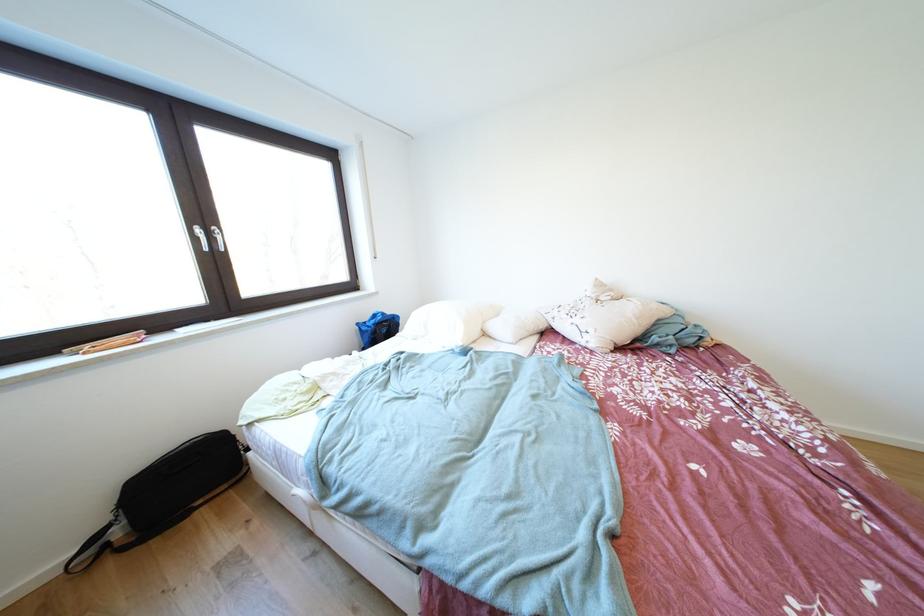
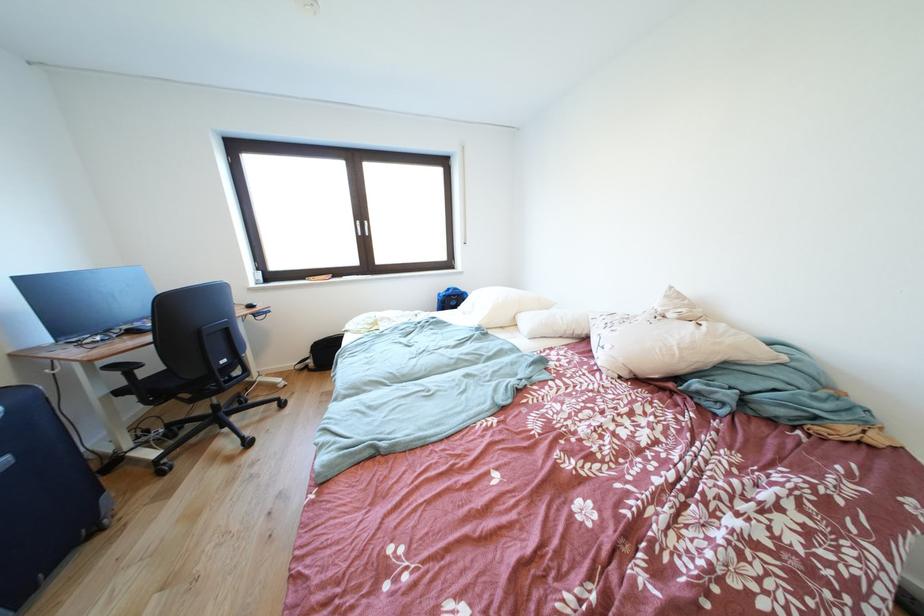
In the second image, find the point that corresponds to point (115, 551) in the first image.

(315, 371)